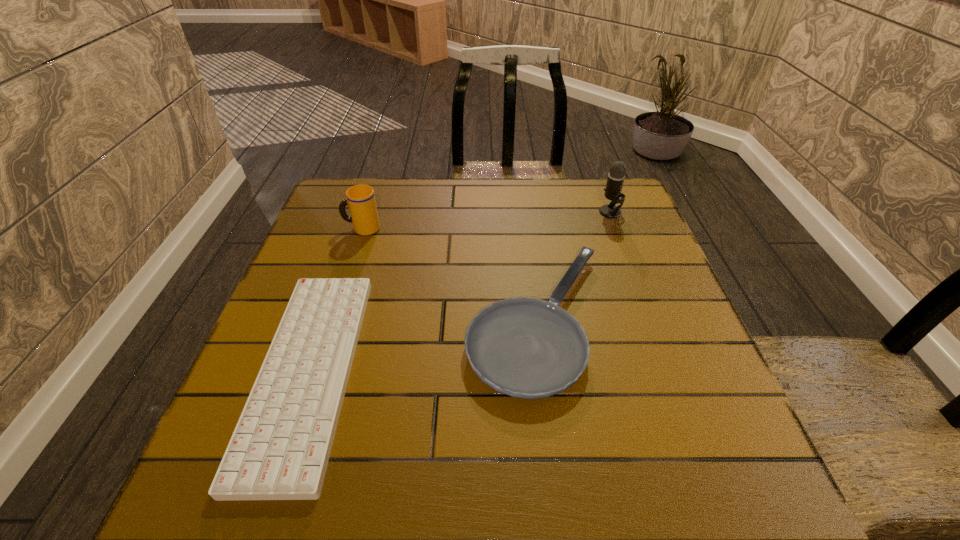
Locate an element on the screen. This screenshot has width=960, height=540. vacant region at the left edge is located at coordinates (259, 356).

In the image, there is a desktop. Where is `blank space at the right edge`? The height and width of the screenshot is (540, 960). blank space at the right edge is located at coordinates (643, 363).

Find the location of a particular element. This screenshot has height=540, width=960. vacant space at the far left corner of the desktop is located at coordinates (389, 182).

Where is `blank region between the third tallest object and the third shortest object`? The image size is (960, 540). blank region between the third tallest object and the third shortest object is located at coordinates (449, 274).

At what (x,y) coordinates should I click in order to perform the action: click on free spot between the computer keyboard and the farthest object. Please return your answer as a coordinate pair (x, y). This screenshot has width=960, height=540. Looking at the image, I should click on click(460, 292).

The image size is (960, 540). Identify the location of free area in between the cup and the rightmost object. (486, 220).

Image resolution: width=960 pixels, height=540 pixels. I want to click on unoccupied position between the microphone and the second tallest object, so click(486, 220).

Where is `vacant space that is in between the frying pan and the cup`? vacant space that is in between the frying pan and the cup is located at coordinates (449, 274).

Locate an element on the screen. The width and height of the screenshot is (960, 540). blank region between the third tallest object and the shortest object is located at coordinates (422, 346).

Locate an element on the screen. vacant area between the shortest object and the frying pan is located at coordinates (422, 346).